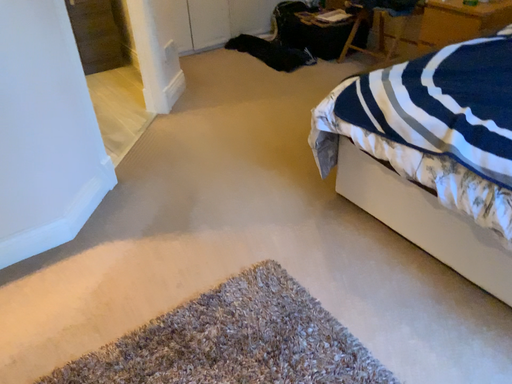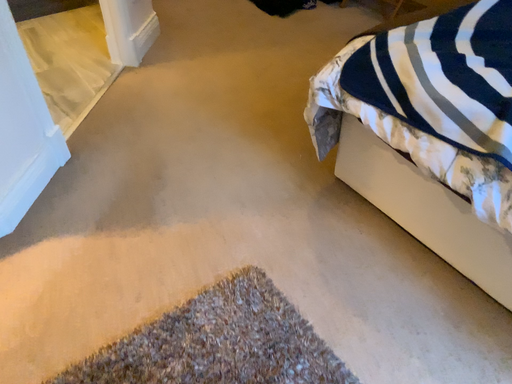
Question: Which way did the camera rotate in the video?

Choices:
 (A) rotated upward
 (B) rotated downward

Answer: (B)